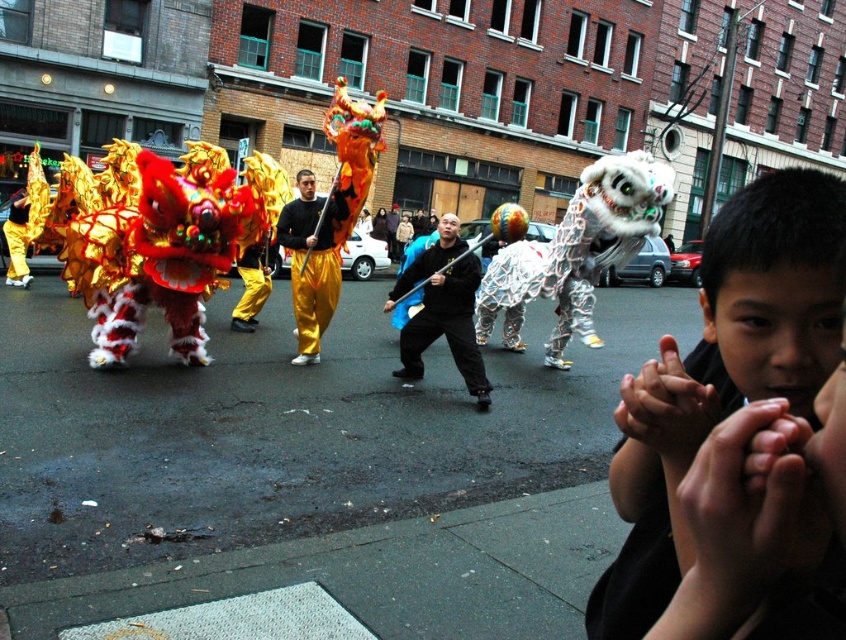
Which is more to the left, smooth black shirt at center or golden silk pants at center?

golden silk pants at center

Which is in front, point (787, 288) or point (279, 224)?

Point (787, 288)

Identify the location of smooth black shirt at center. (722, 374).

Is smooth black shirt at center further to the viewer compared to black matte/softobject at center?

No, it is not.

Can you confirm if smooth black shirt at center is positioned below black matte/softobject at center?

Incorrect, smooth black shirt at center is not positioned below black matte/softobject at center.

Who is more forward, (735, 330) or (410, 326)?

Point (735, 330) is in front.

Identify the location of smooth black shirt at center. (722, 374).

Describe the element at coordinates (442, 310) in the screenshot. The width and height of the screenshot is (846, 640). I see `black matte/softobject at center` at that location.

Does black matte/softobject at center lie in front of golden silk pants at center?

Yes, it is in front of golden silk pants at center.

You are a GUI agent. You are given a task and a screenshot of the screen. Output one action in this format:
    pyautogui.click(x=<x>, y=<y>)
    Task: Click on the black matte/softobject at center
    The width and height of the screenshot is (846, 640).
    Given the screenshot: What is the action you would take?
    pyautogui.click(x=442, y=310)